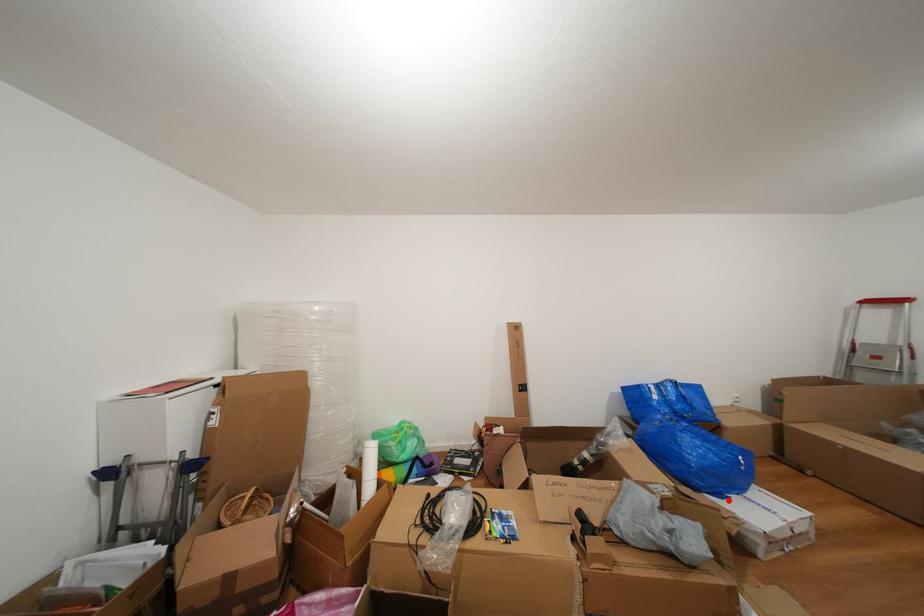
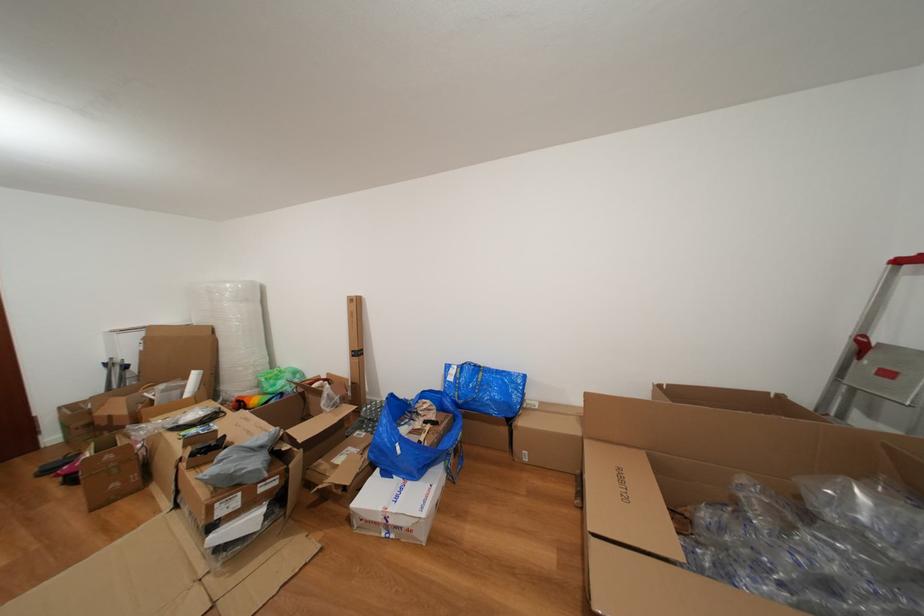
The point at the highlighted location is marked in the first image. Where is the corresponding point in the second image?

(394, 479)